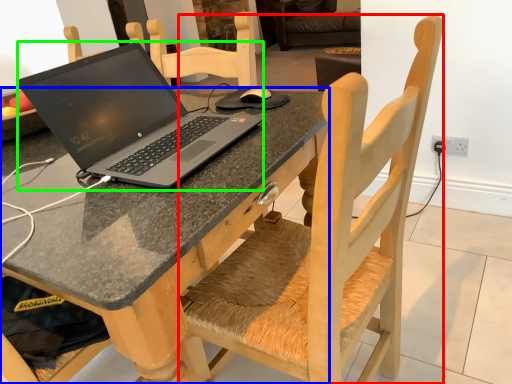
Question: Considering the real-world distances, which object is closest to chair (highlighted by a red box)? desk (highlighted by a blue box) or laptop (highlighted by a green box).

Choices:
 (A) desk
 (B) laptop

Answer: (A)